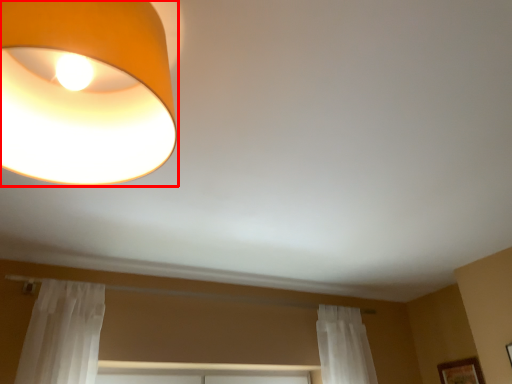
Question: From the image's perspective, what is the correct spatial relationship of lamp (annotated by the red box) in relation to picture frame?

Choices:
 (A) above
 (B) below

Answer: (A)